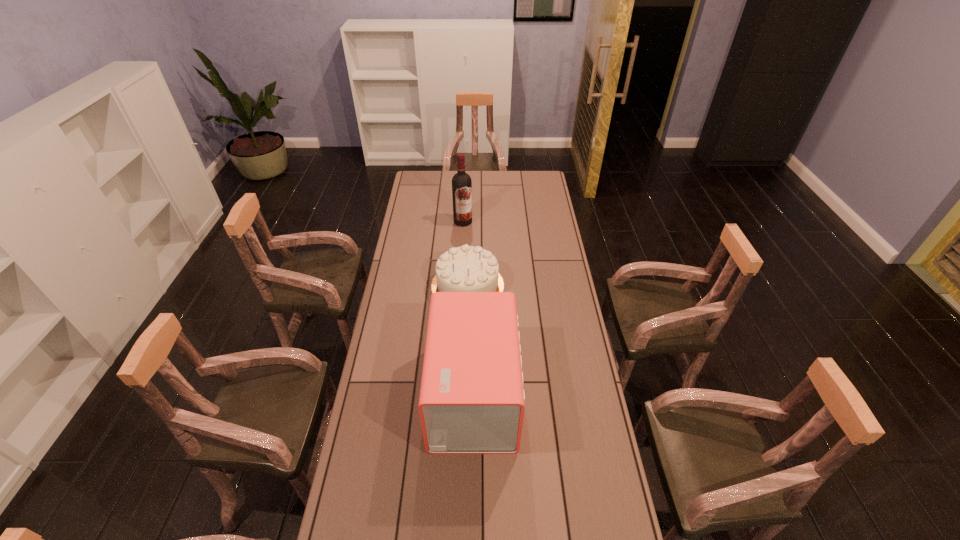
In the image, there is a desktop. In order to click on vacant area at the left edge in this screenshot , I will do `click(420, 316)`.

Identify the location of free point at the right edge. pos(532,204).

This screenshot has width=960, height=540. I want to click on the second closest object relative to the shortest object, so click(461, 182).

I want to click on object identified as the second closest to the farthest object, so click(471, 401).

The width and height of the screenshot is (960, 540). I want to click on free space that satisfies the following two spatial constraints: 1. on the label of the farthest object; 2. on the left side of the second nearest object, so click(x=460, y=285).

Locate an element on the screen. vacant area in the image that satisfies the following two spatial constraints: 1. on the label of the wine bottle; 2. on the right side of the second nearest object is located at coordinates 460,285.